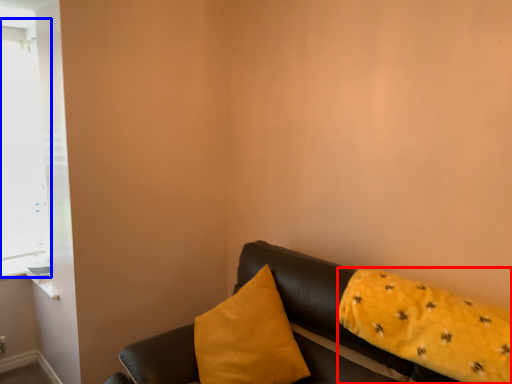
Question: Among these objects, which one is nearest to the camera, pillow (highlighted by a red box) or window (highlighted by a blue box)?

Choices:
 (A) pillow
 (B) window

Answer: (A)